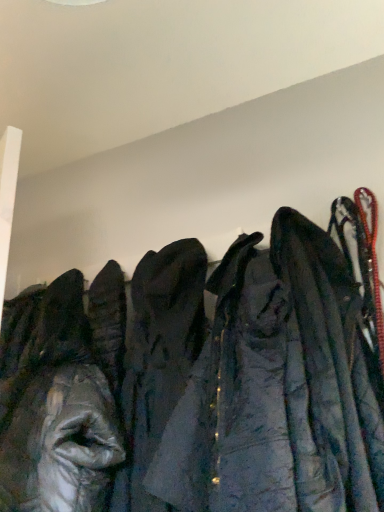
Question: Would you say shiny silver jacket at left is to the left or to the right of dark blue fabric coat at right, which is the 1th cloak in right-to-left order, in the picture?

Choices:
 (A) right
 (B) left

Answer: (B)

Question: Considering the positions of shiny silver jacket at left and dark blue fabric coat at right, which is the 1th cloak in right-to-left order, in the image, is shiny silver jacket at left bigger or smaller than dark blue fabric coat at right, which is the 1th cloak in right-to-left order,?

Choices:
 (A) small
 (B) big

Answer: (B)

Question: Which object is the closest to the dark blue fabric coat at right, which is counted as the second cloak, starting from the left?

Choices:
 (A) dark gray fabric coat at center, which is the second cloak from right to left
 (B) shiny silver jacket at left

Answer: (A)

Question: Estimate the real-world distances between objects in this image. Which object is closer to the dark gray fabric coat at center, which appears as the 1th cloak when viewed from the left?

Choices:
 (A) dark blue fabric coat at right, which is counted as the second cloak, starting from the left
 (B) shiny silver jacket at left

Answer: (B)